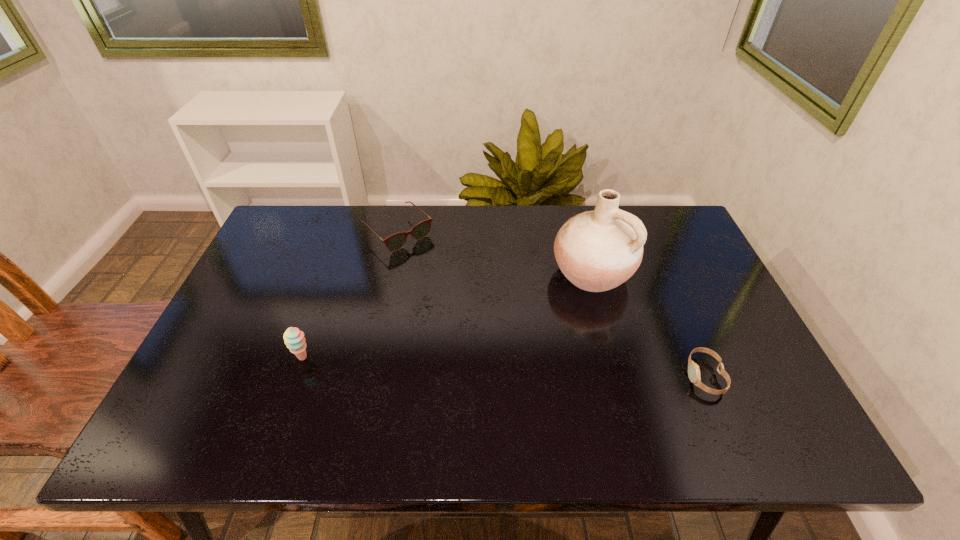
You are a GUI agent. You are given a task and a screenshot of the screen. Output one action in this format:
    pyautogui.click(x=<x>, y=<y>)
    Task: Click on the blank area located on the face of the rightmost object
    The height and width of the screenshot is (540, 960).
    Given the screenshot: What is the action you would take?
    pyautogui.click(x=641, y=376)

Locate an element on the screen. The image size is (960, 540). blank space located on the face of the rightmost object is located at coordinates point(612,376).

I want to click on free space located 0.060m to pour from the handle of the third object from left to right, so click(x=552, y=303).

The height and width of the screenshot is (540, 960). I want to click on free space located to pour from the handle of the third object from left to right, so click(542, 311).

What are the coordinates of `free space located to pour from the handle of the third object from left to right` in the screenshot? It's located at (489, 353).

Locate an element on the screen. vacant point located 0.110m at the front view of the second shortest object is located at coordinates (438, 269).

This screenshot has height=540, width=960. In order to click on free space located at the front view of the second shortest object in this screenshot , I will do `click(443, 273)`.

Identify the location of vacant space located 0.370m at the front view of the second shortest object. (495, 322).

At what (x,y) coordinates should I click in order to perform the action: click on pottery that is positioned at the far edge. Please return your answer as a coordinate pair (x, y). Looking at the image, I should click on (598, 250).

This screenshot has height=540, width=960. I want to click on spectacles present at the far edge, so click(x=395, y=242).